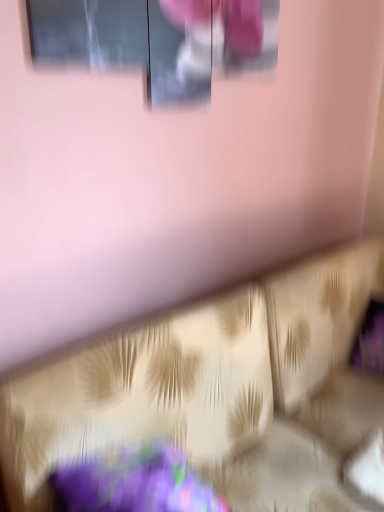
What do you see at coordinates (159, 40) in the screenshot?
I see `matte glass window at upper center` at bounding box center [159, 40].

Measure the distance between point (145, 3) and camera.

1.22 meters.

The height and width of the screenshot is (512, 384). I want to click on matte glass window at upper center, so click(x=159, y=40).

Locate an element on the screen. The width and height of the screenshot is (384, 512). gold textured sofa at lower center is located at coordinates (217, 391).

This screenshot has height=512, width=384. What do you see at coordinates (217, 391) in the screenshot?
I see `gold textured sofa at lower center` at bounding box center [217, 391].

Locate an element on the screen. matte glass window at upper center is located at coordinates (159, 40).

Looking at this image, between gold textured sofa at lower center and matte glass window at upper center, which one appears on the right side from the viewer's perspective?

From the viewer's perspective, gold textured sofa at lower center appears more on the right side.

Who is more distant, gold textured sofa at lower center or matte glass window at upper center?

matte glass window at upper center is further from the camera.

Does point (189, 408) lie behind point (28, 0)?

Yes, point (189, 408) is farther from viewer.

From the image's perspective, between gold textured sofa at lower center and matte glass window at upper center, who is located below?

From the image's view, gold textured sofa at lower center is below.

From a real-world perspective, is gold textured sofa at lower center above or below matte glass window at upper center?

From a real-world perspective, gold textured sofa at lower center is physically below matte glass window at upper center.

Is gold textured sofa at lower center wider or thinner than matte glass window at upper center?

Considering their sizes, gold textured sofa at lower center looks broader than matte glass window at upper center.

Does gold textured sofa at lower center have a lesser height compared to matte glass window at upper center?

No, gold textured sofa at lower center is not shorter than matte glass window at upper center.

Is gold textured sofa at lower center smaller than matte glass window at upper center?

Incorrect, gold textured sofa at lower center is not smaller in size than matte glass window at upper center.

Can we say gold textured sofa at lower center lies outside matte glass window at upper center?

Yes, gold textured sofa at lower center is outside of matte glass window at upper center.

Does gold textured sofa at lower center touch matte glass window at upper center?

They are not placed beside each other.

Does gold textured sofa at lower center turn towards matte glass window at upper center?

No, gold textured sofa at lower center is not facing towards matte glass window at upper center.

What's the angular difference between gold textured sofa at lower center and matte glass window at upper center's facing directions?

There is a 0.164-degree angle between the facing directions of gold textured sofa at lower center and matte glass window at upper center.

Identify the location of window on the left of gold textured sofa at lower center. This screenshot has height=512, width=384. (159, 40).

Can you confirm if matte glass window at upper center is positioned to the right of gold textured sofa at lower center?

Incorrect, matte glass window at upper center is not on the right side of gold textured sofa at lower center.

Consider the image. In the image, is matte glass window at upper center positioned in front of or behind gold textured sofa at lower center?

Visually, matte glass window at upper center is located behind gold textured sofa at lower center.

Considering the positions of point (183, 62) and point (343, 414), is point (183, 62) closer or farther from the camera than point (343, 414)?

Point (183, 62) is closer to the camera than point (343, 414).

From the image's perspective, is matte glass window at upper center located above or below gold textured sofa at lower center?

From the image's perspective, matte glass window at upper center appears above gold textured sofa at lower center.

From a real-world perspective, between matte glass window at upper center and gold textured sofa at lower center, who is vertically lower?

gold textured sofa at lower center.

Between matte glass window at upper center and gold textured sofa at lower center, which one has larger width?

gold textured sofa at lower center is wider.

Considering the sizes of objects matte glass window at upper center and gold textured sofa at lower center in the image provided, who is taller, matte glass window at upper center or gold textured sofa at lower center?

gold textured sofa at lower center.

Considering the relative sizes of matte glass window at upper center and gold textured sofa at lower center in the image provided, is matte glass window at upper center bigger than gold textured sofa at lower center?

No.

From the picture: Do you think matte glass window at upper center is within gold textured sofa at lower center, or outside of it?

matte glass window at upper center lies outside gold textured sofa at lower center.

Would you consider matte glass window at upper center to be distant from gold textured sofa at lower center?

No, matte glass window at upper center is in close proximity to gold textured sofa at lower center.

Is matte glass window at upper center positioned with its back to gold textured sofa at lower center?

No, matte glass window at upper center is not facing away from gold textured sofa at lower center.

Can you tell me how much matte glass window at upper center and gold textured sofa at lower center differ in facing direction?

0.164 degrees separate the facing orientations of matte glass window at upper center and gold textured sofa at lower center.

Identify the location of window on the left side of gold textured sofa at lower center. This screenshot has width=384, height=512. (159, 40).

Identify the location of furniture below the matte glass window at upper center (from the image's perspective). This screenshot has width=384, height=512. (217, 391).

The height and width of the screenshot is (512, 384). I want to click on window on the left of the gold textured sofa at lower center, so click(159, 40).